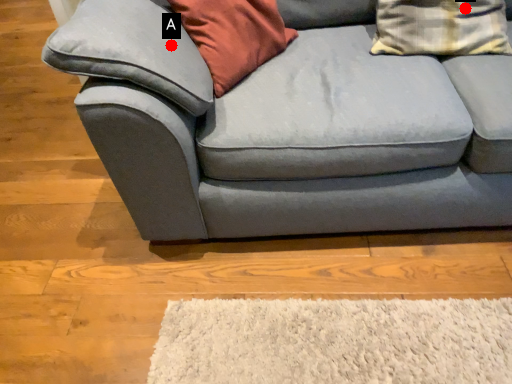
Question: Two points are circled on the image, labeled by A and B beside each circle. Which of the following is the closest to the observer?

Choices:
 (A) A is closer
 (B) B is closer

Answer: (A)